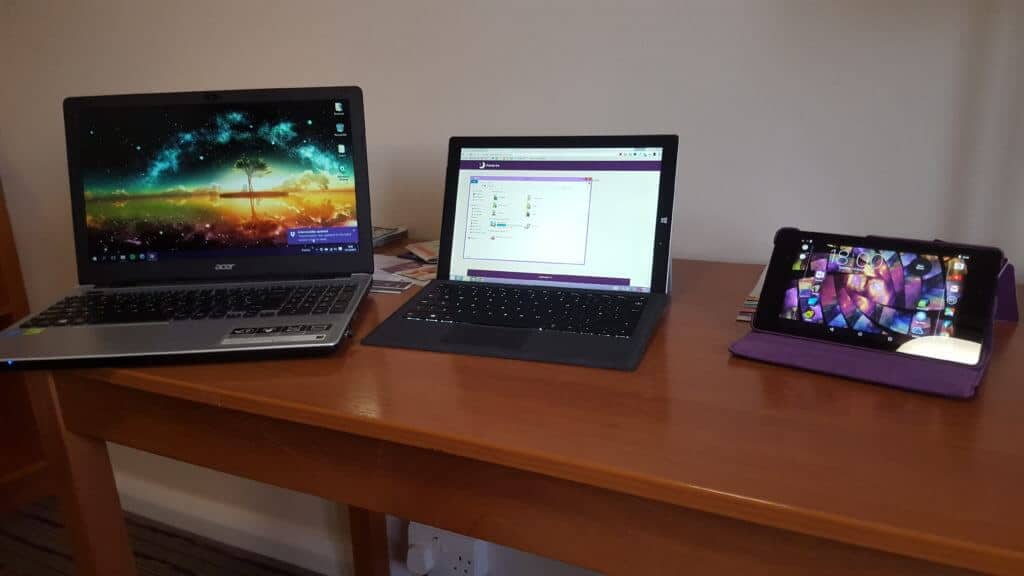
The width and height of the screenshot is (1024, 576). In order to click on laptop screens in this screenshot , I will do `click(610, 208)`, `click(274, 162)`.